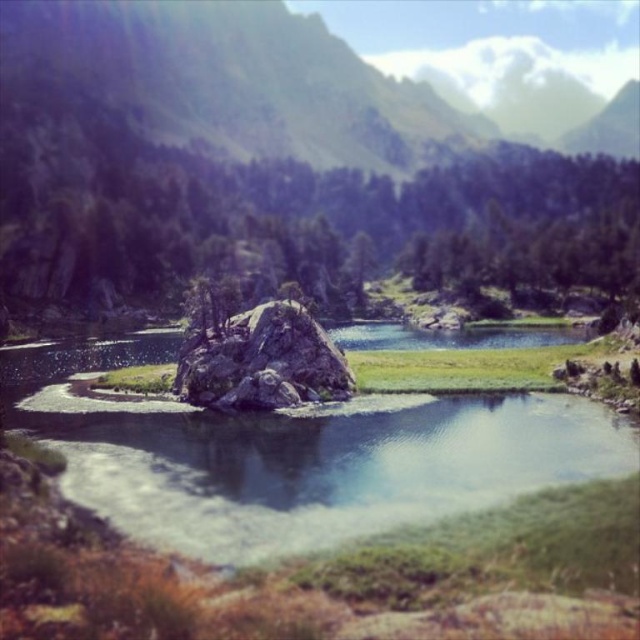
You are a hiker standing at the edge of the lake in the image. You see both the green textured rock at center and the smooth rock at center. Which rock is located to the right when facing the lake?

The green textured rock at center is positioned to the right of the smooth rock at center.

In the scene shown: You are a hiker who wants to place a 100 meter long tent between the green textured rock at center and the smooth rock at center. Based on the scene, will the tent fit between them?

The distance between the green textured rock at center and the smooth rock at center is 82.72 meters. Since the tent is 100 meters long, it will not fit between them as the distance is shorter than the tent.

You are a hiker who wants to place a small camping tent between the green textured rock at center and the smooth rock at center. Which rock should you place the tent closer to if you want it to be farther from the larger rock?

The green textured rock at center is bigger than the smooth rock at center. To place the tent farther from the larger rock, you should position it closer to the smooth rock at center.